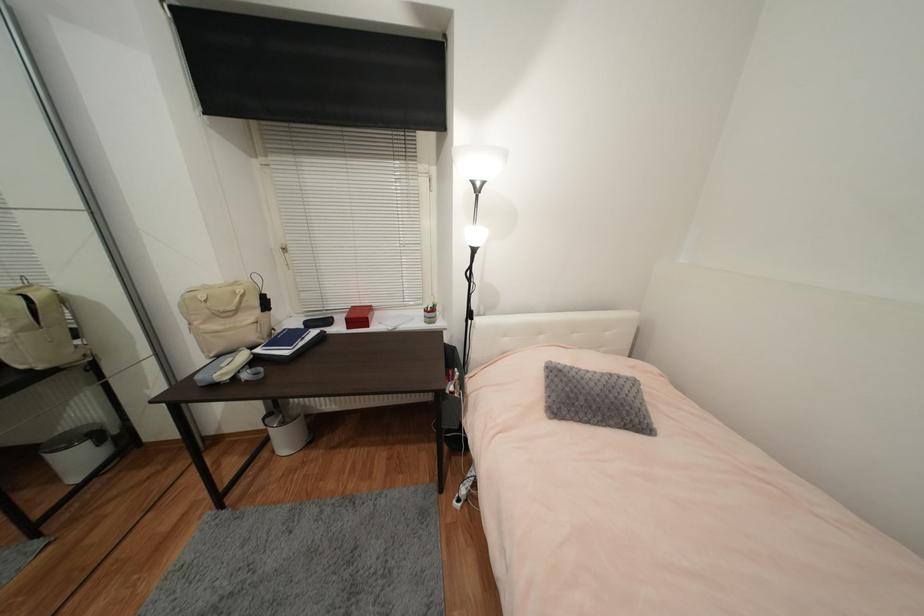
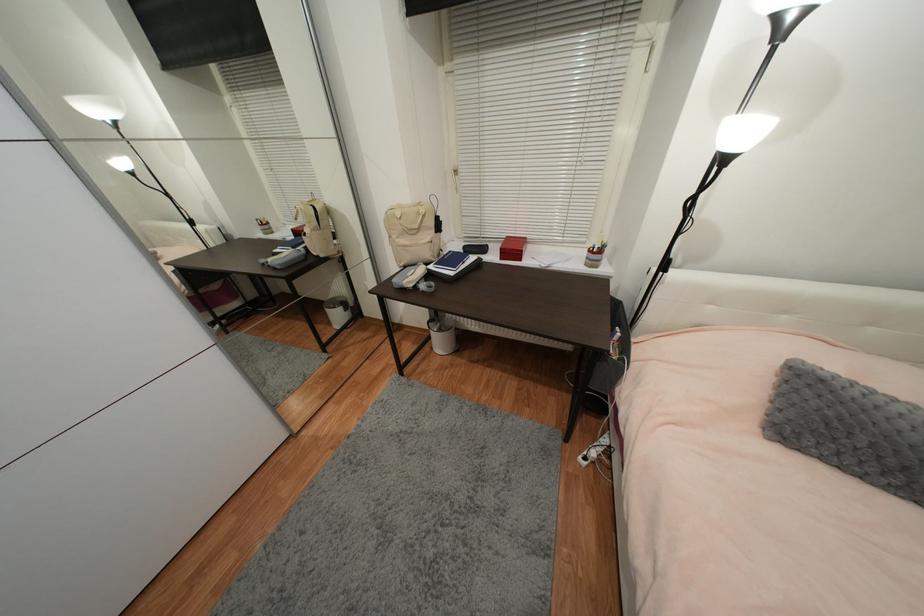
The images are taken continuously from a first-person perspective. In which direction is your viewpoint rotating?

The rotation direction of the camera is left-down.